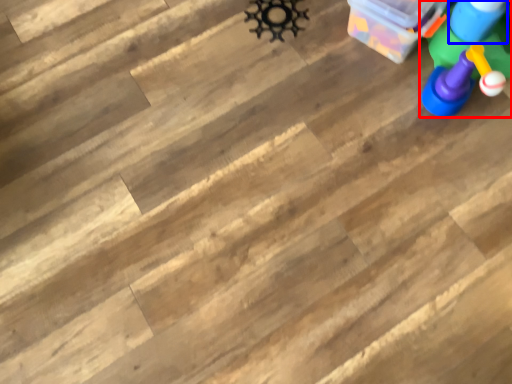
Question: Which object is further to the camera taking this photo, toy (highlighted by a red box) or toy (highlighted by a blue box)?

Choices:
 (A) toy
 (B) toy

Answer: (B)